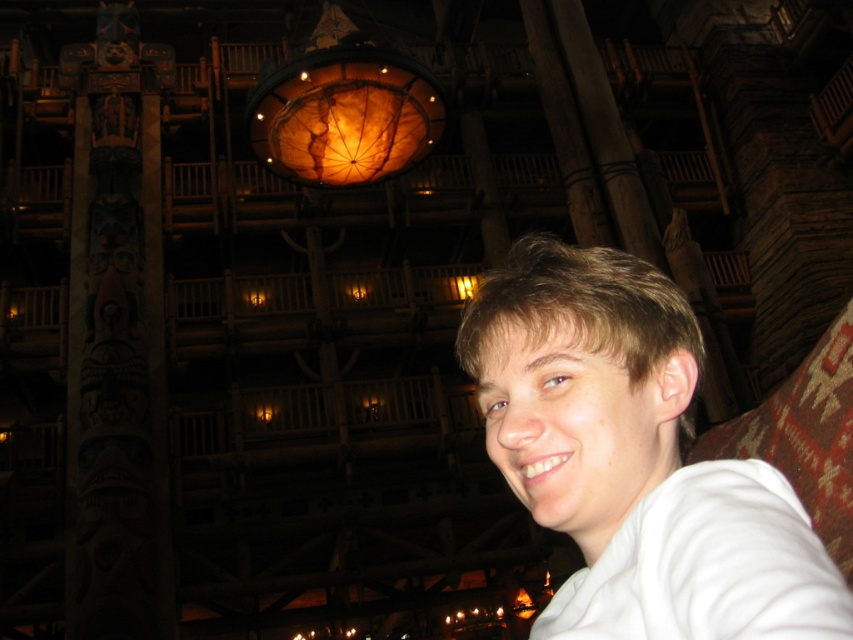
You are a photographer setting up a shoot in this grand wooden structure. You need to position a camera so that it can capture both the white matte shirt at center and the translucent amber glass at center in the same frame. Based on their positions, which object should you place on the left side of the camera frame?

The translucent amber glass at center should be placed on the left side of the camera frame because the white matte shirt at center is to the right of it.

You are a photographer trying to capture a closeup of the white matte shirt at center and the translucent amber glass at center. Which object should you zoom in on more to ensure both fit in the frame?

The white matte shirt at center is narrower than the translucent amber glass at center, so you should zoom in more on the shirt to ensure both fit in the frame.